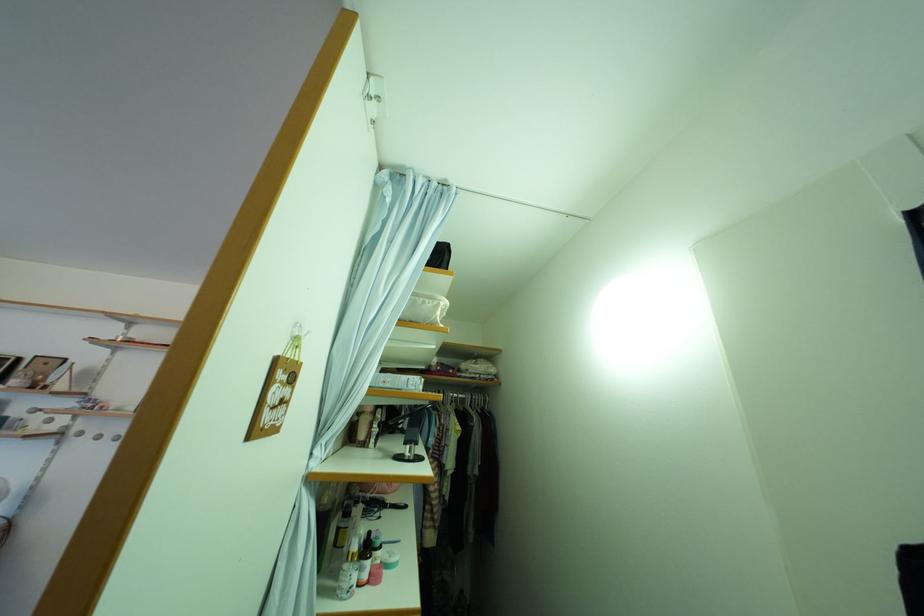
Locate an element on the screen. This screenshot has width=924, height=616. white bottle cap is located at coordinates (390, 559).